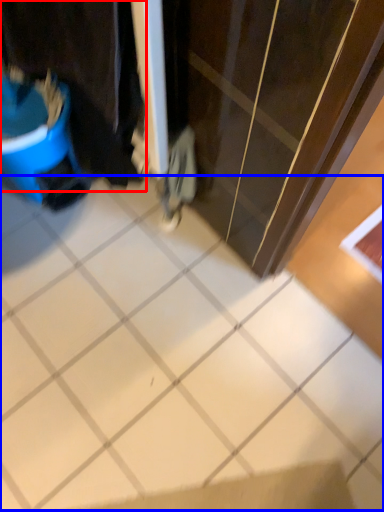
Question: Which point is closer to the camera, laundry (highlighted by a red box) or ceramic tile (highlighted by a blue box)?

Choices:
 (A) laundry
 (B) ceramic tile

Answer: (B)